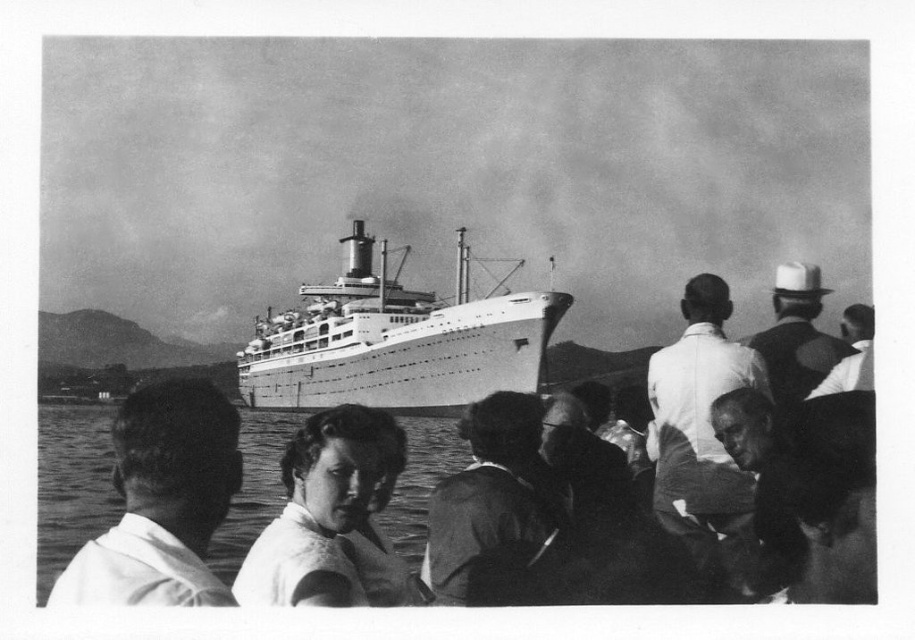
Question: Can you confirm if white cotton shirt at center is bigger than smooth leather jacket at center?

Choices:
 (A) no
 (B) yes

Answer: (B)

Question: Does white cotton shirt at center appear on the left side of white cotton shirt at center-right?

Choices:
 (A) yes
 (B) no

Answer: (A)

Question: Which point is closer to the camera?

Choices:
 (A) smooth white hat at upper right
 (B) white cotton shirt at center
 (C) white cotton shirt at center-right
 (D) white matte shirt at lower left

Answer: (D)

Question: Is white matte shirt at lower left closer to the viewer compared to white cotton shirt at center-right?

Choices:
 (A) no
 (B) yes

Answer: (B)

Question: Which point is closer to the camera?

Choices:
 (A) smooth leather jacket at center
 (B) smooth white hat at upper right
 (C) clear water at lower center
 (D) white cotton shirt at center

Answer: (D)

Question: Which object is closer to the camera taking this photo?

Choices:
 (A) smooth white hat at upper right
 (B) smooth leather jacket at center

Answer: (B)